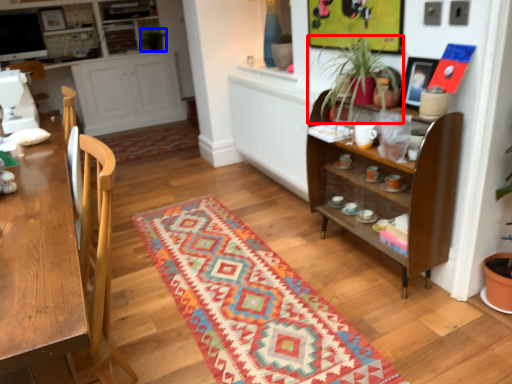
Question: Which of the following is the farthest to the observer, houseplant (highlighted by a red box) or plant (highlighted by a blue box)?

Choices:
 (A) houseplant
 (B) plant

Answer: (B)